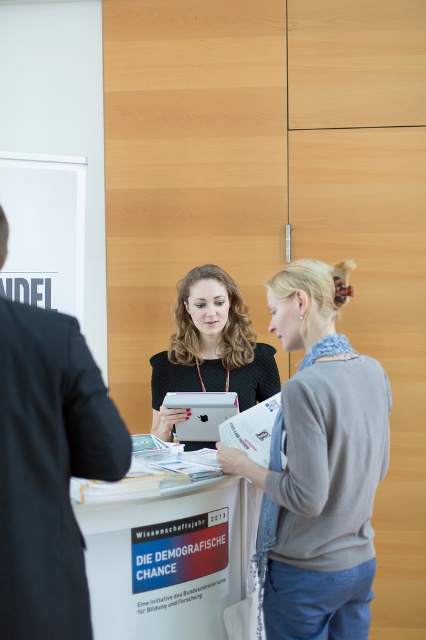
You are standing in the conference room and need to place a small plant on the table. The plant requires a spot that is not occupied by the gray sweater at center. Where should you place it?

Since the gray sweater at center is located at point (319,465), you can place the plant anywhere else on the table except that specific coordinate.

You are organizing a workshop and need to place a decorative ribbon along the edge of the table. The ribbon is exactly the same width as the gray sweater at center. Will the ribbon be long enough to cover the edge of the white cardboard sign at center without cutting?

The gray sweater at center has a lesser width compared to white cardboard sign at center. Since the ribbon matches the sweater width, it won not be long enough to cover the edge of the white cardboard sign at center.